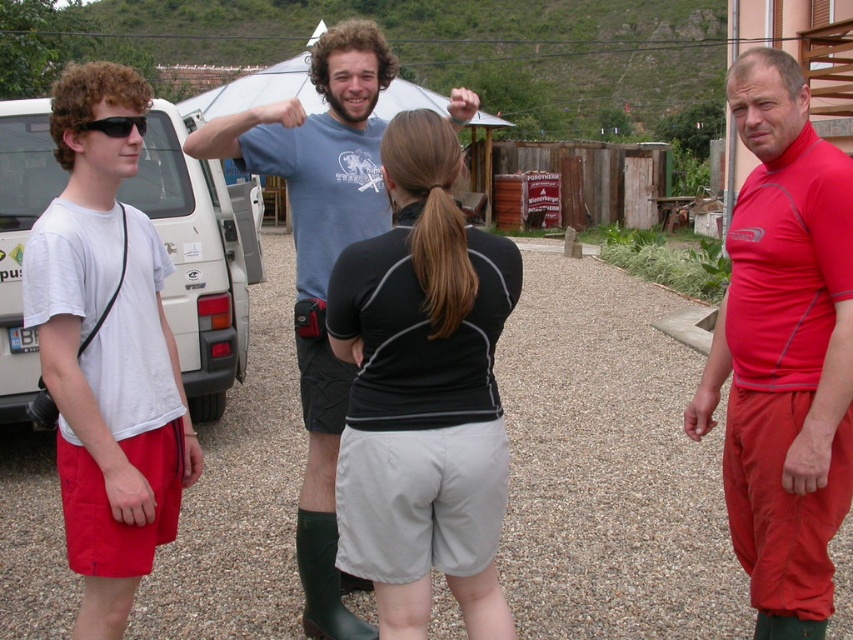
Does point (505, 244) come closer to viewer compared to point (90, 124)?

Yes, it is.

Does point (432, 397) come behind point (138, 124)?

No, it is not.

Where is `black matte shorts at center`? The width and height of the screenshot is (853, 640). black matte shorts at center is located at coordinates click(422, 392).

Identify the location of black matte shorts at center. This screenshot has width=853, height=640. (422, 392).

Who is lower down, black matte shorts at center or blue cotton t-shirt at center?

blue cotton t-shirt at center is below.

Is black matte shorts at center shorter than blue cotton t-shirt at center?

Correct, black matte shorts at center is not as tall as blue cotton t-shirt at center.

Who is more forward, (416, 552) or (283, 113)?

Point (416, 552) is more forward.

Where is `black matte shorts at center`? The image size is (853, 640). black matte shorts at center is located at coordinates (422, 392).

Is white cotton t-shirt at left positioned before blue cotton t-shirt at center?

Yes.

Can you confirm if white cotton t-shirt at left is smaller than blue cotton t-shirt at center?

Yes.

Which is behind, point (82, 216) or point (352, 241)?

Point (352, 241)

Where is `white cotton t-shirt at left`? The height and width of the screenshot is (640, 853). white cotton t-shirt at left is located at coordinates (107, 352).